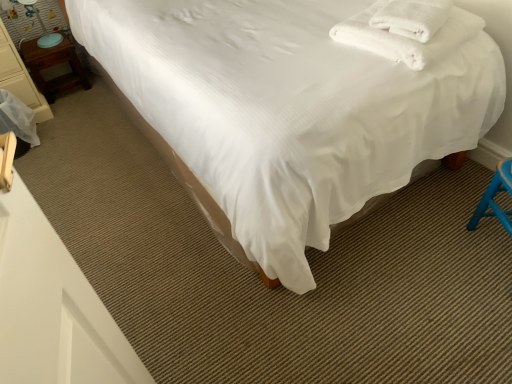
Where is `free space that is in between wooden nightstand at left and white smooth bed at center`? Image resolution: width=512 pixels, height=384 pixels. free space that is in between wooden nightstand at left and white smooth bed at center is located at coordinates (113, 160).